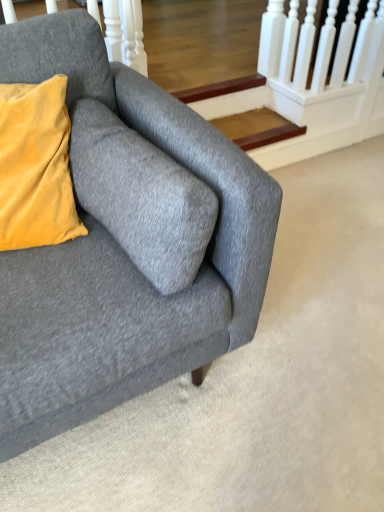
The image size is (384, 512). What do you see at coordinates (121, 250) in the screenshot?
I see `gray fabric couch at lower left` at bounding box center [121, 250].

In order to face gray fabric couch at lower left, should I rotate leftwards or rightwards?

You should rotate left by 16.591 degrees.

At what (x,y) coordinates should I click in order to perform the action: click on gray fabric couch at lower left. Please return your answer as a coordinate pair (x, y). The image size is (384, 512). Looking at the image, I should click on (121, 250).

Measure the distance between velvet yellow pillow at upper left and camera.

32.00 inches.

What do you see at coordinates (115, 153) in the screenshot? This screenshot has width=384, height=512. I see `velvet yellow pillow at upper left` at bounding box center [115, 153].

Locate an element on the screen. The width and height of the screenshot is (384, 512). velvet yellow pillow at upper left is located at coordinates (115, 153).

Identify the location of gray fabric couch at lower left. (121, 250).

Consider the image. Considering the relative positions of velvet yellow pillow at upper left and gray fabric couch at lower left in the image provided, is velvet yellow pillow at upper left to the right of gray fabric couch at lower left from the viewer's perspective?

In fact, velvet yellow pillow at upper left is to the left of gray fabric couch at lower left.

Is velvet yellow pillow at upper left positioned in front of gray fabric couch at lower left?

No, velvet yellow pillow at upper left is behind gray fabric couch at lower left.

Is point (62, 41) positioned after point (51, 311)?

Yes, it is behind point (51, 311).

From the image's perspective, relative to gray fabric couch at lower left, is velvet yellow pillow at upper left above or below?

Clearly, from the image's perspective, velvet yellow pillow at upper left is above gray fabric couch at lower left.

From a real-world perspective, who is located higher, velvet yellow pillow at upper left or gray fabric couch at lower left?

From a 3D spatial view, velvet yellow pillow at upper left is above.

Does velvet yellow pillow at upper left have a lesser width compared to gray fabric couch at lower left?

Correct, the width of velvet yellow pillow at upper left is less than that of gray fabric couch at lower left.

Considering the sizes of velvet yellow pillow at upper left and gray fabric couch at lower left in the image, is velvet yellow pillow at upper left taller or shorter than gray fabric couch at lower left?

Considering their sizes, velvet yellow pillow at upper left has less height than gray fabric couch at lower left.

Between velvet yellow pillow at upper left and gray fabric couch at lower left, which one has larger size?

gray fabric couch at lower left is bigger.

Can we say velvet yellow pillow at upper left lies outside gray fabric couch at lower left?

No.

Does velvet yellow pillow at upper left touch gray fabric couch at lower left?

Yes.

Could you tell me if velvet yellow pillow at upper left is facing gray fabric couch at lower left?

Yes, velvet yellow pillow at upper left is aimed at gray fabric couch at lower left.

Locate an element on the screen. Image resolution: width=384 pixels, height=512 pixels. swivel chair above the gray fabric couch at lower left (from a real-world perspective) is located at coordinates (115, 153).

Is gray fabric couch at lower left to the left or to the right of velvet yellow pillow at upper left in the image?

gray fabric couch at lower left is positioned on velvet yellow pillow at upper left's right side.

Relative to velvet yellow pillow at upper left, is gray fabric couch at lower left in front or behind?

gray fabric couch at lower left is positioned closer to the viewer than velvet yellow pillow at upper left.

Does point (31, 413) come in front of point (33, 68)?

That is True.

From the image's perspective, between gray fabric couch at lower left and velvet yellow pillow at upper left, who is located below?

gray fabric couch at lower left appears lower in the image.

From a real-world perspective, is gray fabric couch at lower left physically located above or below velvet yellow pillow at upper left?

From a real-world perspective, gray fabric couch at lower left is physically below velvet yellow pillow at upper left.

Between gray fabric couch at lower left and velvet yellow pillow at upper left, which one has smaller width?

Thinner between the two is velvet yellow pillow at upper left.

Consider the image. Is gray fabric couch at lower left shorter than velvet yellow pillow at upper left?

No.

Considering the sizes of objects gray fabric couch at lower left and velvet yellow pillow at upper left in the image provided, who is bigger, gray fabric couch at lower left or velvet yellow pillow at upper left?

Bigger between the two is gray fabric couch at lower left.

Is gray fabric couch at lower left completely or partially outside of velvet yellow pillow at upper left?

Yes, gray fabric couch at lower left is located beyond the bounds of velvet yellow pillow at upper left.

Is gray fabric couch at lower left far from velvet yellow pillow at upper left?

No, there isn't a large distance between gray fabric couch at lower left and velvet yellow pillow at upper left.

In the scene shown: Is gray fabric couch at lower left aimed at velvet yellow pillow at upper left?

Yes, gray fabric couch at lower left is aimed at velvet yellow pillow at upper left.

Identify the location of swivel chair on the left of gray fabric couch at lower left. The height and width of the screenshot is (512, 384). (115, 153).

Locate an element on the screen. swivel chair behind the gray fabric couch at lower left is located at coordinates (115, 153).

The width and height of the screenshot is (384, 512). In order to click on swivel chair that is above the gray fabric couch at lower left (from the image's perspective) in this screenshot , I will do `click(115, 153)`.